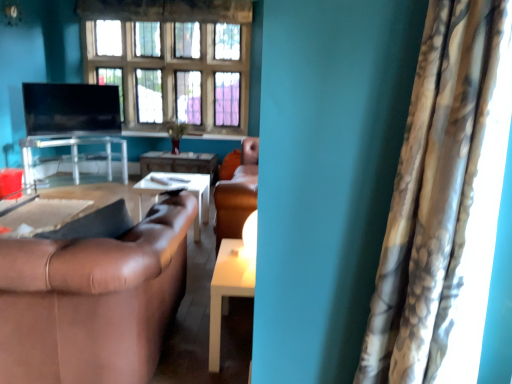
Identify the location of matte black tv at upper left. The height and width of the screenshot is (384, 512). (71, 108).

The width and height of the screenshot is (512, 384). Describe the element at coordinates (228, 289) in the screenshot. I see `white glossy table at center, acting as the first table starting from the right` at that location.

Find the location of a particular element. wooden frame window at upper center is located at coordinates [x=172, y=58].

Is point (129, 24) farther from camera compared to point (140, 253)?

Yes, point (129, 24) is farther from viewer.

Would you say wooden frame window at upper center is inside or outside brown leather couch at lower left?

wooden frame window at upper center is not inside brown leather couch at lower left, it's outside.

Is wooden frame window at upper center shorter than brown leather couch at lower left?

Incorrect, the height of wooden frame window at upper center does not fall short of that of brown leather couch at lower left.

How different are the orientations of white glossy table at center, acting as the first table starting from the right, and wooden glossy table at center, marked as the second table in a right-to-left arrangement, in degrees?

white glossy table at center, acting as the first table starting from the right, and wooden glossy table at center, marked as the second table in a right-to-left arrangement, are facing 2.15 degrees away from each other.

Consider the image. Is white glossy table at center, placed as the 1th table when sorted from front to back, to the left of wooden glossy table at center, the 2th table when ordered from left to right, from the viewer's perspective?

Incorrect, white glossy table at center, placed as the 1th table when sorted from front to back, is not on the left side of wooden glossy table at center, the 2th table when ordered from left to right.

Which object is wider, white glossy table at center, marked as the 3th table in a top-to-bottom arrangement, or wooden glossy table at center, the 2th table from the bottom?

white glossy table at center, marked as the 3th table in a top-to-bottom arrangement, is wider.

Is matte black tv at upper left spatially inside brown leather couch at lower left, or outside of it?

matte black tv at upper left lies outside brown leather couch at lower left.

Is matte black tv at upper left not close to brown leather couch at lower left?

matte black tv at upper left is positioned a significant distance from brown leather couch at lower left.

Is white glossy table at center, arranged as the 3th table when viewed from the left, located outside brown leather couch at lower left?

Yes, white glossy table at center, arranged as the 3th table when viewed from the left, is located beyond the bounds of brown leather couch at lower left.

Considering the sizes of objects white glossy table at center, acting as the first table starting from the right, and brown leather couch at lower left in the image provided, who is taller, white glossy table at center, acting as the first table starting from the right, or brown leather couch at lower left?

brown leather couch at lower left.

Locate an element on the screen. This screenshot has width=512, height=384. studio couch positioned vertically above the white glossy table at center, arranged as the first table when ordered from the bottom (from a real-world perspective) is located at coordinates (93, 300).

Is white glossy table at center, marked as the 3th table in a top-to-bottom arrangement, in front of brown leather couch at lower left?

That is False.

Between wooden glossy table at center, arranged as the third table when viewed from the front, and brown leather couch at lower left, which one has smaller width?

With smaller width is wooden glossy table at center, arranged as the third table when viewed from the front.

Based on the photo, considering the positions of objects wooden glossy table at center, arranged as the 2th table when viewed from the top, and brown leather couch at lower left in the image provided, who is more to the left, wooden glossy table at center, arranged as the 2th table when viewed from the top, or brown leather couch at lower left?

Positioned to the left is wooden glossy table at center, arranged as the 2th table when viewed from the top.

Is wooden glossy table at center, arranged as the 2th table when viewed from the top, positioned in front of brown leather couch at lower left?

No.

From the image's perspective, is wooden glossy table at center, the 2th table from the bottom, above or below brown leather couch at lower left?

wooden glossy table at center, the 2th table from the bottom, is situated higher than brown leather couch at lower left in the image.

From the image's perspective, which is below, brown leather couch at lower left or white glossy table at center, marked as the 3th table in a top-to-bottom arrangement?

white glossy table at center, marked as the 3th table in a top-to-bottom arrangement, from the image's perspective.

Is white glossy table at center, arranged as the 3th table when viewed from the left, a part of brown leather couch at lower left?

No, white glossy table at center, arranged as the 3th table when viewed from the left, is not a part of brown leather couch at lower left.

Locate an element on the screen. This screenshot has width=512, height=384. studio couch that appears on the left of white glossy table at center, marked as the 3th table in a top-to-bottom arrangement is located at coordinates (93, 300).

The height and width of the screenshot is (384, 512). I want to click on flat that appears below the wooden frame window at upper center (from a real-world perspective), so click(x=71, y=108).

From a real-world perspective, is wooden frame window at upper center physically located above or below matte black tv at upper left?

From a real-world perspective, wooden frame window at upper center is physically above matte black tv at upper left.

Between point (165, 101) and point (63, 98), which one is positioned behind?

The point (165, 101) is more distant.

Is wooden frame window at upper center wider or thinner than matte black tv at upper left?

Considering their sizes, wooden frame window at upper center looks broader than matte black tv at upper left.

Where is `studio couch directly beneath the wooden frame window at upper center (from a real-world perspective)`? studio couch directly beneath the wooden frame window at upper center (from a real-world perspective) is located at coordinates (93, 300).

Identify the location of the 1st table above when counting from the white glossy table at center, arranged as the 3th table when viewed from the left (from the image's perspective). This screenshot has width=512, height=384. (179, 163).

When comparing their distances from clear glass table at center, arranged as the 1th table when viewed from the top, does brown leather couch at lower left or wooden glossy table at center, arranged as the third table when viewed from the front, seem further?

Based on the image, brown leather couch at lower left appears to be further to clear glass table at center, arranged as the 1th table when viewed from the top.

Which object lies further to the anchor point clear glass table at center, acting as the second table starting from the front, brown leather couch at lower left or matte black tv at upper left?

brown leather couch at lower left.

Based on their spatial positions, is wooden glossy table at center, arranged as the 2th table when viewed from the top, or wooden frame window at upper center further from camouflage fabric curtain at right?

wooden frame window at upper center lies further to camouflage fabric curtain at right than the other object.

Considering their positions, is wooden frame window at upper center positioned further to camouflage fabric curtain at right than clear glass table at center, arranged as the 1th table when viewed from the top?

wooden frame window at upper center.

Estimate the real-world distances between objects in this image. Which object is further from wooden frame window at upper center, white glossy table at center, placed as the 1th table when sorted from front to back, or brown leather couch at lower left?

brown leather couch at lower left is further to wooden frame window at upper center.

When comparing their distances from wooden glossy table at center, arranged as the third table when viewed from the front, does clear glass table at center, the third table positioned from the bottom, or camouflage fabric curtain at right seem further?

camouflage fabric curtain at right is further to wooden glossy table at center, arranged as the third table when viewed from the front.

Which object lies nearer to the anchor point clear glass table at center, the third table positioned from the right, wooden frame window at upper center or white glossy table at center, acting as the first table starting from the right?

wooden frame window at upper center lies closer to clear glass table at center, the third table positioned from the right, than the other object.

From the picture: Based on their spatial positions, is wooden frame window at upper center or wooden glossy table at center, the 2th table from the bottom, further from camouflage fabric curtain at right?

The object further to camouflage fabric curtain at right is wooden frame window at upper center.

Where is `flat between clear glass table at center, the third table positioned from the right, and wooden glossy table at center, placed as the 1th table when sorted from back to front, in the horizontal direction`? This screenshot has width=512, height=384. flat between clear glass table at center, the third table positioned from the right, and wooden glossy table at center, placed as the 1th table when sorted from back to front, in the horizontal direction is located at coordinates (71, 108).

Where is `flat positioned between camouflage fabric curtain at right and wooden glossy table at center, the 2th table from the bottom, from near to far`? This screenshot has width=512, height=384. flat positioned between camouflage fabric curtain at right and wooden glossy table at center, the 2th table from the bottom, from near to far is located at coordinates (71, 108).

What are the coordinates of `flat that lies between wooden frame window at upper center and wooden glossy table at center, arranged as the 2th table when viewed from the top, from top to bottom` in the screenshot? It's located at (71, 108).

This screenshot has width=512, height=384. In order to click on table between wooden frame window at upper center and wooden glossy table at center, placed as the 1th table when sorted from back to front, in the vertical direction in this screenshot , I will do `click(73, 154)`.